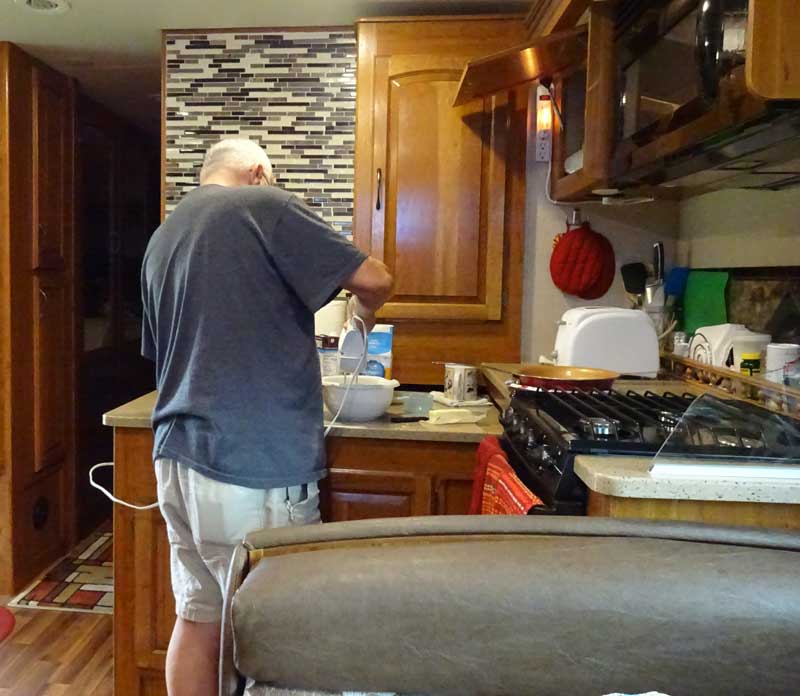
Locate an element on the screen. Image resolution: width=800 pixels, height=696 pixels. wooden floor is located at coordinates pos(58,681).